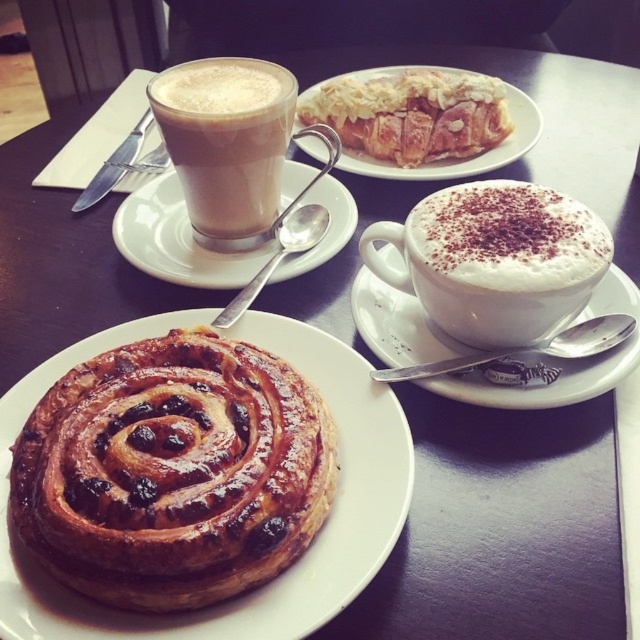
Between golden brown flaky pastry at center and white ceramic saucer at upper left, which one has more height?

With more height is white ceramic saucer at upper left.

I want to click on golden brown flaky pastry at center, so pyautogui.click(x=172, y=472).

Between point (58, 572) and point (145, 266), which one is positioned in front?

Positioned in front is point (58, 572).

Locate an element on the screen. The height and width of the screenshot is (640, 640). golden brown flaky pastry at center is located at coordinates (172, 472).

Is golden brown flaky pastry at center positioned at the back of golden flaky pastry at upper center?

That is False.

Between golden brown flaky pastry at center and golden flaky pastry at upper center, which one appears on the right side from the viewer's perspective?

golden flaky pastry at upper center is more to the right.

This screenshot has width=640, height=640. In order to click on golden brown flaky pastry at center in this screenshot , I will do `click(172, 472)`.

Image resolution: width=640 pixels, height=640 pixels. Identify the location of golden brown flaky pastry at center. (172, 472).

How much distance is there between golden flaky pastry at upper center and white ceramic saucer at upper left?

The distance of golden flaky pastry at upper center from white ceramic saucer at upper left is 25.87 centimeters.

Who is more distant from viewer, (436,99) or (243,272)?

Positioned behind is point (436,99).

Who is more distant from viewer, (428, 136) or (179, 282)?

Point (428, 136)

Where is `golden flaky pastry at upper center`? This screenshot has width=640, height=640. golden flaky pastry at upper center is located at coordinates (412, 115).